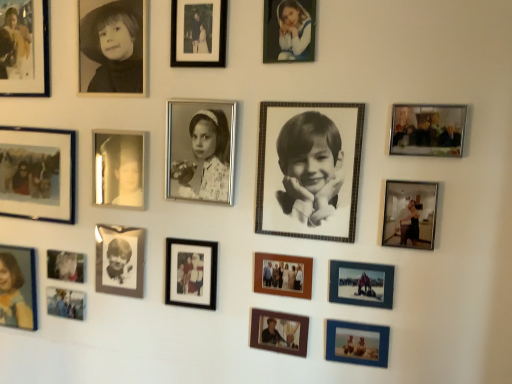
Question: Is matte blue photo frame at lower center, which is the third picture frame from right to left, wider than matte black photo frame at upper left, marked as the 14th picture frame in a right-to-left arrangement?

Choices:
 (A) yes
 (B) no

Answer: (B)

Question: Is matte blue photo frame at lower center, the 12th picture frame from the left, thinner than matte black photo frame at upper left, acting as the 1th picture frame starting from the left?

Choices:
 (A) yes
 (B) no

Answer: (A)

Question: Can you confirm if matte blue photo frame at lower center, the 12th picture frame from the left, is positioned to the left of matte black photo frame at upper left, marked as the 14th picture frame in a right-to-left arrangement?

Choices:
 (A) no
 (B) yes

Answer: (A)

Question: Is the position of matte blue photo frame at lower center, which is the third picture frame from right to left, less distant than that of matte black photo frame at upper left, acting as the 1th picture frame starting from the left?

Choices:
 (A) no
 (B) yes

Answer: (B)

Question: From a real-world perspective, is matte blue photo frame at lower center, which is the third picture frame from right to left, positioned under matte black photo frame at upper left, acting as the 1th picture frame starting from the left, based on gravity?

Choices:
 (A) yes
 (B) no

Answer: (A)

Question: From the image's perspective, is matte blue photo frame at lower center, the 12th picture frame from the left, located beneath matte black photo frame at upper left, marked as the 14th picture frame in a right-to-left arrangement?

Choices:
 (A) yes
 (B) no

Answer: (A)

Question: Is black glossy photo frame at lower left, placed as the fifth picture frame when sorted from left to right, far away from black paper at upper left, arranged as the 4th person when viewed from the right?

Choices:
 (A) no
 (B) yes

Answer: (A)

Question: Is black glossy photo frame at lower left, which is counted as the 10th picture frame, starting from the right, behind black paper at upper left, the 2th person viewed from the left?

Choices:
 (A) yes
 (B) no

Answer: (A)

Question: Is black glossy photo frame at lower left, which is counted as the 10th picture frame, starting from the right, placed right next to black paper at upper left, the second person when ordered from back to front?

Choices:
 (A) yes
 (B) no

Answer: (B)

Question: Is black glossy photo frame at lower left, placed as the fifth picture frame when sorted from left to right, at the right side of black paper at upper left, the 2th person viewed from the left?

Choices:
 (A) yes
 (B) no

Answer: (A)

Question: From the image's perspective, does black glossy photo frame at lower left, which is counted as the 10th picture frame, starting from the right, appear higher than black paper at upper left, which is the 4th person from front to back?

Choices:
 (A) yes
 (B) no

Answer: (B)

Question: Considering the relative positions of black glossy photo frame at lower left, placed as the fifth picture frame when sorted from left to right, and black paper at upper left, which is the 4th person from front to back, in the image provided, is black glossy photo frame at lower left, placed as the fifth picture frame when sorted from left to right, in front of black paper at upper left, which is the 4th person from front to back,?

Choices:
 (A) yes
 (B) no

Answer: (B)

Question: Does matte blue photo frame at lower center, which is the third picture frame from right to left, lie behind matte black photo frame at center, acting as the 7th picture frame starting from the left?

Choices:
 (A) yes
 (B) no

Answer: (B)